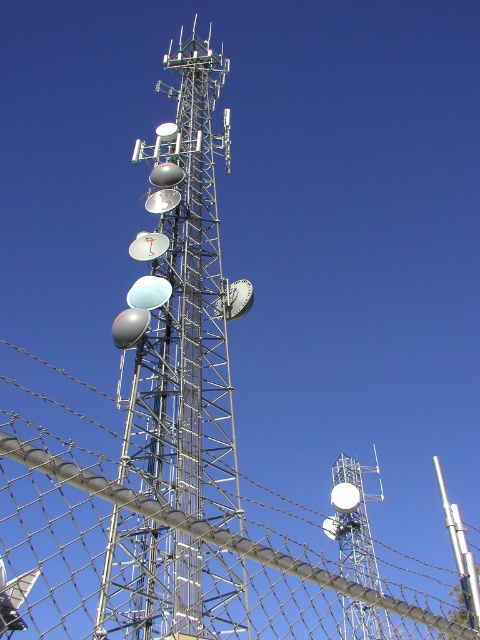
Does point (205, 241) lie in front of point (356, 620)?

That is True.

Does metallic silver tower at center appear on the left side of silver metallic tower at center?

Indeed, metallic silver tower at center is positioned on the left side of silver metallic tower at center.

Between point (201, 438) and point (370, 579), which one is positioned behind?

The point (370, 579) is more distant.

Identify the location of metallic silver tower at center. (182, 308).

Between wire mesh fence at center and silver metallic tower at center, which one is positioned lower?

Positioned lower is silver metallic tower at center.

Can you confirm if wire mesh fence at center is taller than silver metallic tower at center?

Yes.

This screenshot has width=480, height=640. Describe the element at coordinates (179, 529) in the screenshot. I see `wire mesh fence at center` at that location.

What are the coordinates of `wire mesh fence at center` in the screenshot? It's located at (179, 529).

Between wire mesh fence at center and metallic silver tower at center, which one appears on the left side from the viewer's perspective?

wire mesh fence at center is more to the left.

Does point (162, 573) come in front of point (180, 621)?

No, it is not.

The height and width of the screenshot is (640, 480). I want to click on wire mesh fence at center, so click(x=179, y=529).